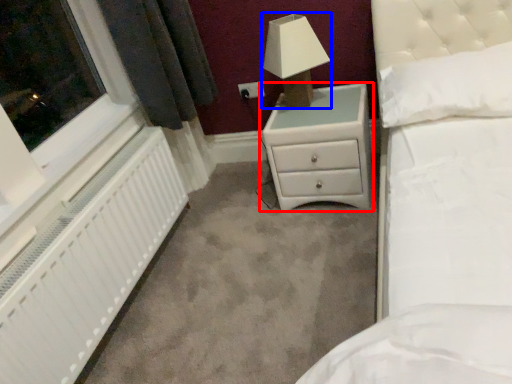
Question: Among these objects, which one is farthest to the camera, chest of drawers (highlighted by a red box) or lamp (highlighted by a blue box)?

Choices:
 (A) chest of drawers
 (B) lamp

Answer: (A)